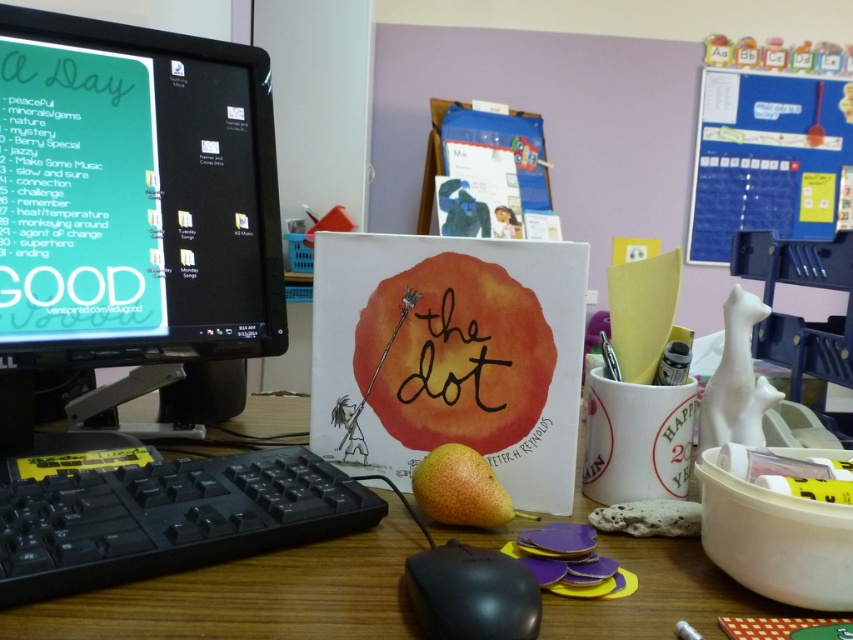
Does matte black monitor at left appear on the right side of wooden table at center?

No, matte black monitor at left is not to the right of wooden table at center.

Who is positioned more to the right, matte black monitor at left or wooden table at center?

Positioned to the right is wooden table at center.

This screenshot has width=853, height=640. In order to click on matte black monitor at left in this screenshot , I will do `click(131, 202)`.

Between black plastic keyboard at lower left and blue fabric calendar at upper right, which one has less height?

black plastic keyboard at lower left

Identify the location of black plastic keyboard at lower left. This screenshot has width=853, height=640. (166, 516).

Locate an element on the screen. black plastic keyboard at lower left is located at coordinates (166, 516).

Who is more distant from viewer, [714,628] or [485,493]?

The point [485,493] is behind.

What do you see at coordinates (251, 595) in the screenshot? I see `wooden table at center` at bounding box center [251, 595].

I want to click on wooden table at center, so (x=251, y=595).

The height and width of the screenshot is (640, 853). I want to click on wooden table at center, so [251, 595].